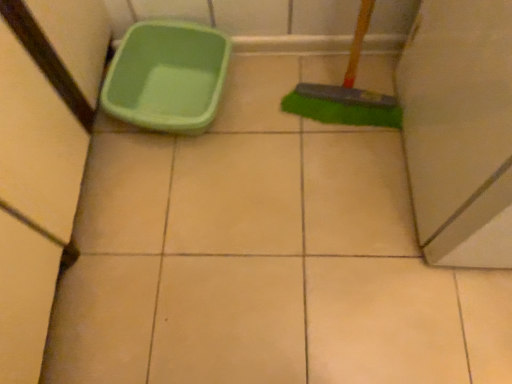
You are a GUI agent. You are given a task and a screenshot of the screen. Output one action in this format:
    pyautogui.click(x=<x>, y=<y>)
    Task: Click on the free location to the right of green plastic tray at upper left
    
    Given the screenshot: What is the action you would take?
    pyautogui.click(x=279, y=113)